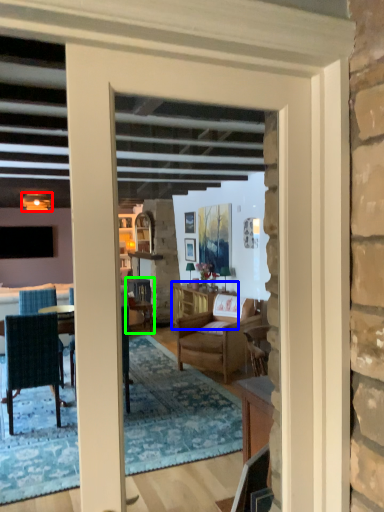
Question: Based on their relative distances, which object is nearer to lamp (highlighted by a red box)? Choose from cabinetry (highlighted by a blue box) and chair (highlighted by a green box).

Choices:
 (A) cabinetry
 (B) chair

Answer: (B)